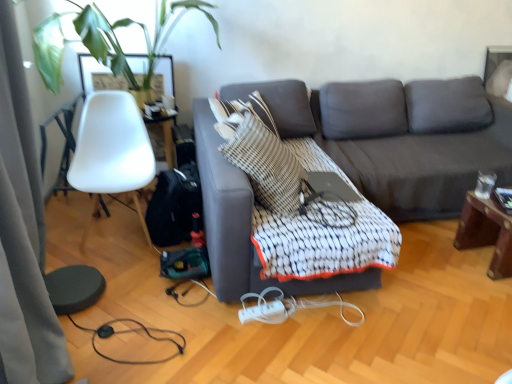
This screenshot has width=512, height=384. Find the location of `free area in between white plastic cable at lower center, positioned as the first cable in right-to-left order, and black rubber cable at lower left, the 2th cable positioned from the right`. free area in between white plastic cable at lower center, positioned as the first cable in right-to-left order, and black rubber cable at lower left, the 2th cable positioned from the right is located at coordinates (220, 336).